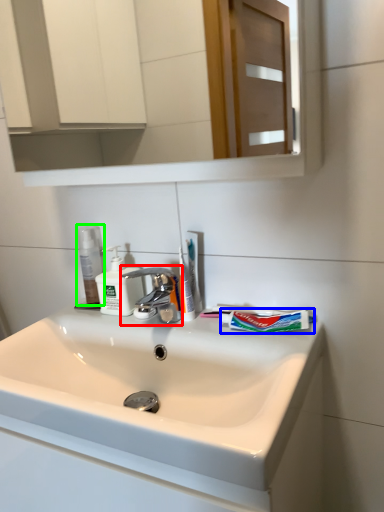
Question: Considering the real-world distances, which object is closest to tap (highlighted by a red box)? toothpaste (highlighted by a blue box) or mouthwash (highlighted by a green box).

Choices:
 (A) toothpaste
 (B) mouthwash

Answer: (B)